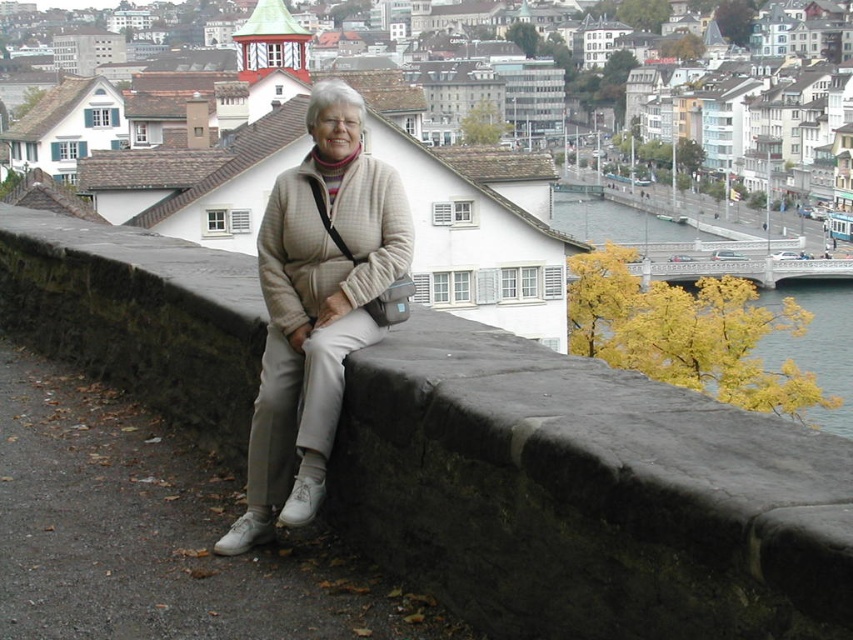
Which of these two, dark gray stone ledge at center or beige woolen sweater at center, stands shorter?

Standing shorter between the two is dark gray stone ledge at center.

The width and height of the screenshot is (853, 640). What do you see at coordinates (585, 493) in the screenshot? I see `dark gray stone ledge at center` at bounding box center [585, 493].

Where is `dark gray stone ledge at center`? The height and width of the screenshot is (640, 853). dark gray stone ledge at center is located at coordinates (585, 493).

Between point (351, 161) and point (651, 324), which one is positioned in front?

Positioned in front is point (351, 161).

Which is behind, point (387, 205) or point (817, 358)?

The point (817, 358) is more distant.

This screenshot has width=853, height=640. I want to click on beige woolen sweater at center, so click(316, 307).

This screenshot has height=640, width=853. I want to click on beige woolen sweater at center, so click(316, 307).

Does dark gray stone ledge at center have a lesser height compared to yellow leafy tree at upper right?

Indeed, dark gray stone ledge at center has a lesser height compared to yellow leafy tree at upper right.

Between dark gray stone ledge at center and yellow leafy tree at upper right, which one is positioned higher?

yellow leafy tree at upper right is above.

Describe the element at coordinates (585, 493) in the screenshot. The width and height of the screenshot is (853, 640). I see `dark gray stone ledge at center` at that location.

You are a GUI agent. You are given a task and a screenshot of the screen. Output one action in this format:
    pyautogui.click(x=<x>, y=<y>)
    Task: Click on the dark gray stone ledge at center
    
    Given the screenshot: What is the action you would take?
    pyautogui.click(x=585, y=493)